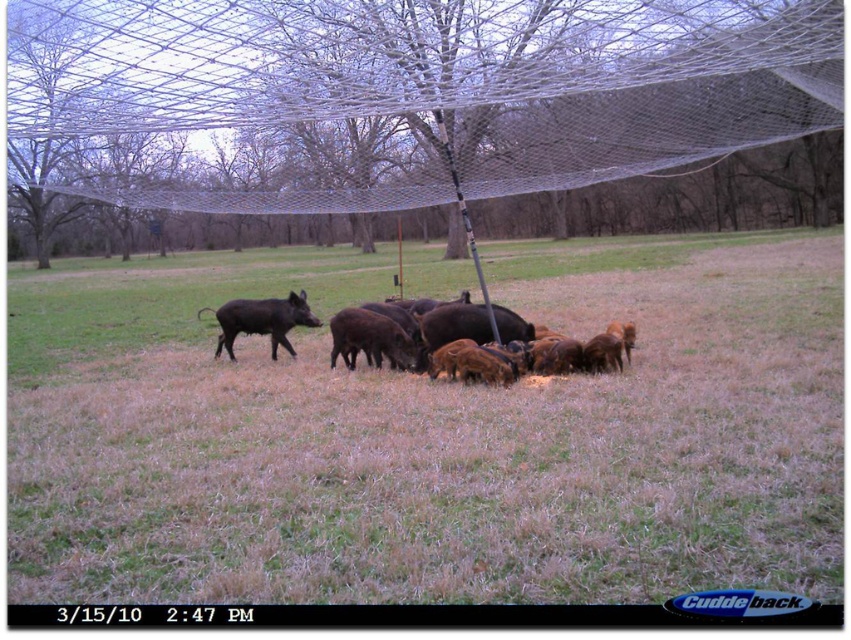
You are a wildlife photographer standing at the edge of the field. You want to take a photo of the shiny black boar at center without the white mesh net at center appearing in the frame. The camera you are using has a focal length of 200mm. Can you achieve this? Please explain your reasoning.

The white mesh net at center and shiny black boar at center are 10.55 meters apart. With a 200mm focal length, the photographer can adjust their position to frame the boar while excluding the net, as the distance between them allows for selective composition without the net overlapping in the shot.

You are a farmer checking the feeding area. You notice the white mesh net at center and the shiny black boar at center. Which object is closer to you?

The white mesh net at center is closer to you since it is positioned in front of the shiny black boar at center.

You are a wildlife photographer trying to capture a closeup of the dark brown fur piglet at center. You notice the brown dry grass at center is blocking your view. Which direction should you move to get a clear shot of the piglet?

Move to the right side of the brown dry grass at center to get a clear view of the dark brown fur piglet at center since the grass is to the left of the piglet.